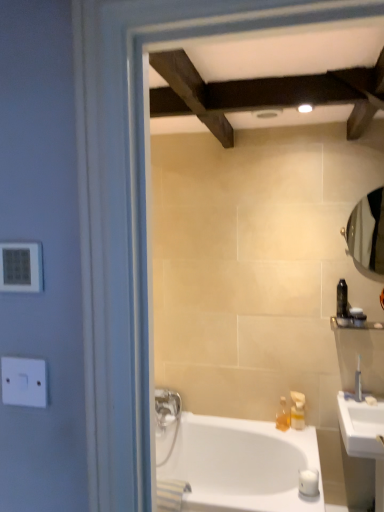
Question: From the image's perspective, would you say satin nickel faucet at right is positioned over white plastic electric outlet at left, which is the 2th electric outlet in bottom-to-top order?

Choices:
 (A) no
 (B) yes

Answer: (A)

Question: Does satin nickel faucet at right have a greater height compared to white plastic electric outlet at left, which is the 2th electric outlet in bottom-to-top order?

Choices:
 (A) no
 (B) yes

Answer: (B)

Question: Can you confirm if satin nickel faucet at right is positioned to the right of white plastic electric outlet at left, acting as the first electric outlet starting from the top?

Choices:
 (A) no
 (B) yes

Answer: (B)

Question: Does satin nickel faucet at right come behind white plastic electric outlet at left, acting as the first electric outlet starting from the top?

Choices:
 (A) no
 (B) yes

Answer: (B)

Question: Considering the relative sizes of satin nickel faucet at right and white plastic electric outlet at left, acting as the first electric outlet starting from the top, in the image provided, is satin nickel faucet at right thinner than white plastic electric outlet at left, acting as the first electric outlet starting from the top,?

Choices:
 (A) no
 (B) yes

Answer: (A)

Question: Is white plastic electric outlet at left, which is the 2th electric outlet in bottom-to-top order, surrounded by satin nickel faucet at right?

Choices:
 (A) yes
 (B) no

Answer: (B)

Question: Can you confirm if satin nickel faucet at right is thinner than white plastic switch at left, the second electric outlet when ordered from top to bottom?

Choices:
 (A) no
 (B) yes

Answer: (A)

Question: From the image's perspective, would you say satin nickel faucet at right is positioned over white plastic switch at left, which is the first electric outlet in bottom-to-top order?

Choices:
 (A) no
 (B) yes

Answer: (A)

Question: Considering the relative sizes of satin nickel faucet at right and white plastic switch at left, the second electric outlet when ordered from top to bottom, in the image provided, is satin nickel faucet at right wider than white plastic switch at left, the second electric outlet when ordered from top to bottom,?

Choices:
 (A) yes
 (B) no

Answer: (A)

Question: Is satin nickel faucet at right closer to the viewer compared to white plastic switch at left, which is the first electric outlet in bottom-to-top order?

Choices:
 (A) no
 (B) yes

Answer: (A)

Question: Is there a large distance between satin nickel faucet at right and white plastic switch at left, which is the first electric outlet in bottom-to-top order?

Choices:
 (A) no
 (B) yes

Answer: (B)

Question: Is satin nickel faucet at right beside white plastic switch at left, the second electric outlet when ordered from top to bottom?

Choices:
 (A) no
 (B) yes

Answer: (A)

Question: Can you confirm if clear glass mirror at right is bigger than white plastic switch at left, which is the first electric outlet in bottom-to-top order?

Choices:
 (A) no
 (B) yes

Answer: (B)